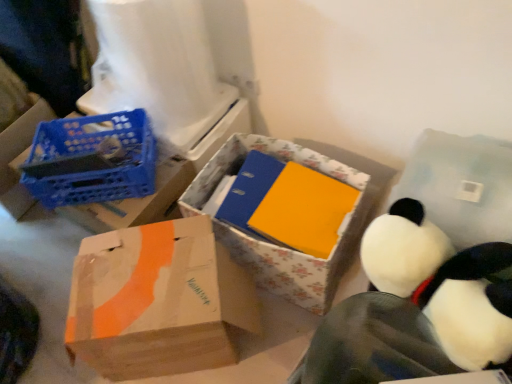
Question: Does floral cardboard box at center, which is the third box from left to right, have a lesser width compared to brown cardboard box at lower left, positioned as the second box in left-to-right order?

Choices:
 (A) no
 (B) yes

Answer: (A)

Question: Are floral cardboard box at center, which is the third box from left to right, and brown cardboard box at lower left, arranged as the second box when viewed from the right, making contact?

Choices:
 (A) no
 (B) yes

Answer: (A)

Question: Would you say floral cardboard box at center, which is the first box in right-to-left order, is outside brown cardboard box at lower left, arranged as the second box when viewed from the right?

Choices:
 (A) yes
 (B) no

Answer: (A)

Question: From the image's perspective, is floral cardboard box at center, which is the third box from left to right, above brown cardboard box at lower left, positioned as the second box in left-to-right order?

Choices:
 (A) yes
 (B) no

Answer: (A)

Question: From a real-world perspective, is floral cardboard box at center, which is the first box in right-to-left order, over brown cardboard box at lower left, arranged as the second box when viewed from the right?

Choices:
 (A) no
 (B) yes

Answer: (B)

Question: Considering the relative positions of floral cardboard box at center, which is the third box from left to right, and brown cardboard box at lower left, positioned as the second box in left-to-right order, in the image provided, is floral cardboard box at center, which is the third box from left to right, to the left of brown cardboard box at lower left, positioned as the second box in left-to-right order, from the viewer's perspective?

Choices:
 (A) yes
 (B) no

Answer: (B)

Question: Can white plastic toilet paper at upper left be found inside blue plastic crate at left, the 1th box in the left-to-right sequence?

Choices:
 (A) yes
 (B) no

Answer: (B)

Question: From the image's perspective, is blue plastic crate at left, the third box when ordered from right to left, on white plastic toilet paper at upper left?

Choices:
 (A) yes
 (B) no

Answer: (B)

Question: From a real-world perspective, is blue plastic crate at left, the third box when ordered from right to left, beneath white plastic toilet paper at upper left?

Choices:
 (A) no
 (B) yes

Answer: (B)

Question: Does blue plastic crate at left, the third box when ordered from right to left, come behind white plastic toilet paper at upper left?

Choices:
 (A) yes
 (B) no

Answer: (A)

Question: Is blue plastic crate at left, the third box when ordered from right to left, smaller than white plastic toilet paper at upper left?

Choices:
 (A) yes
 (B) no

Answer: (B)

Question: Is blue plastic crate at left, the third box when ordered from right to left, next to white plastic toilet paper at upper left?

Choices:
 (A) yes
 (B) no

Answer: (B)

Question: Is the depth of white plush toy at upper right greater than that of brown cardboard box at lower left, arranged as the second box when viewed from the right?

Choices:
 (A) yes
 (B) no

Answer: (B)